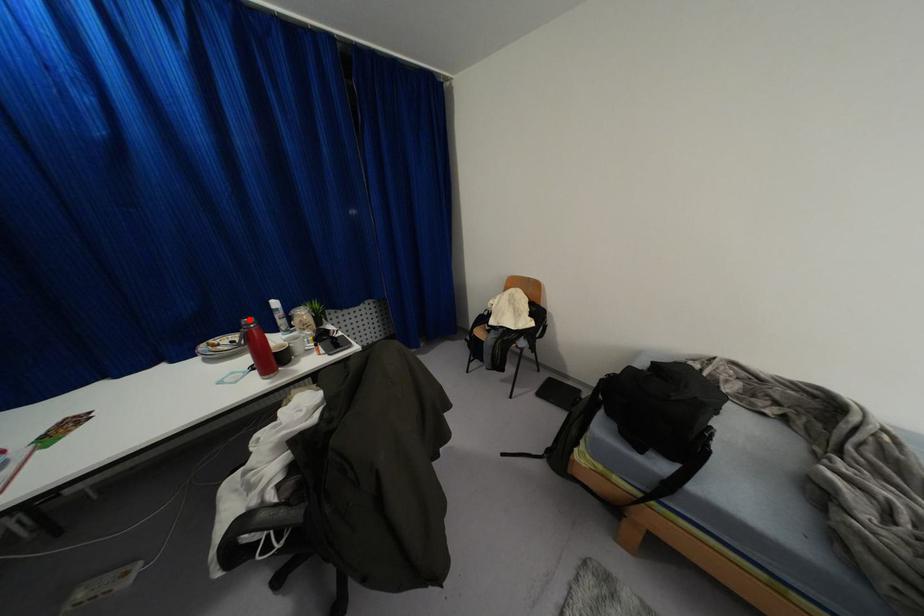
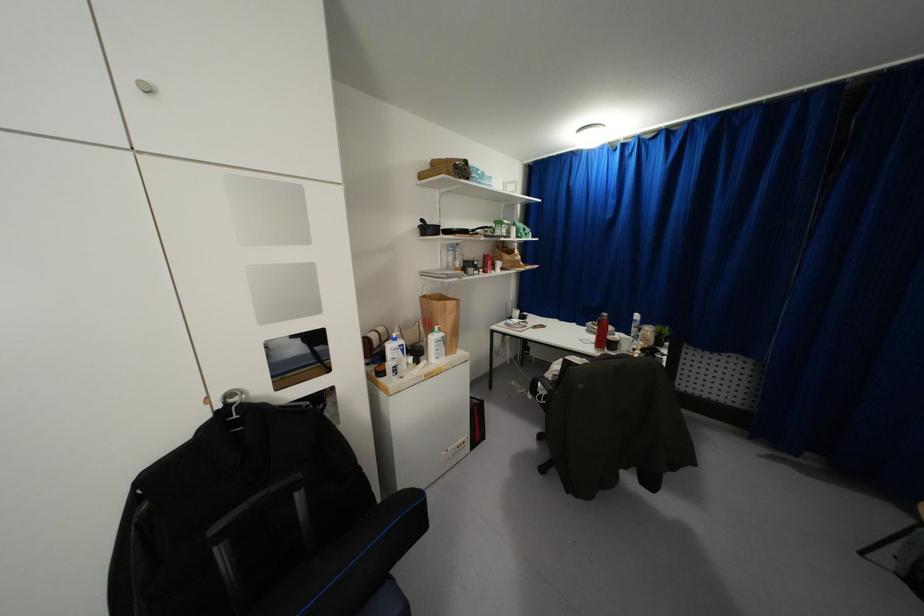
Question: I am providing you with two images of the same scene from different viewpoints. A red point is shown in image1. For the corresponding object point in image2, is it positioned nearer or farther from the camera?

Choices:
 (A) Nearer
 (B) Farther

Answer: (A)